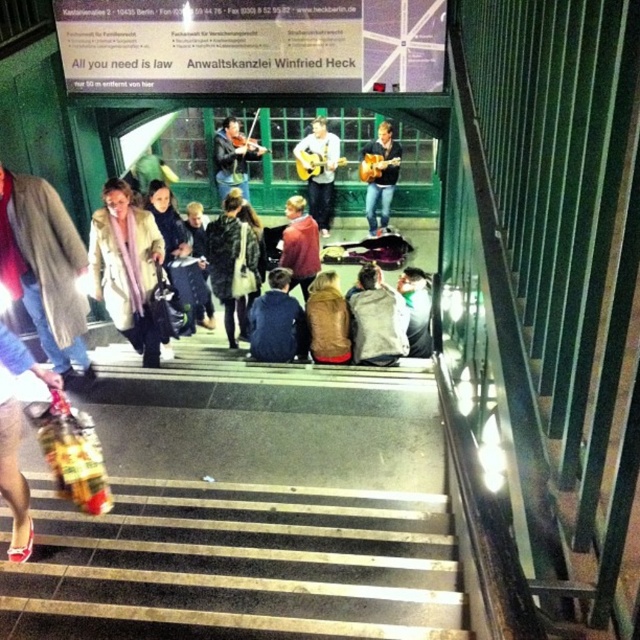
Is leather jacket at center smaller than wooden acoustic guitar at center?

Correct, leather jacket at center occupies less space than wooden acoustic guitar at center.

Who is more distant from viewer, [230,301] or [326,140]?

The point [326,140] is more distant.

Which is in front, point (218, 289) or point (314, 209)?

Point (218, 289)

Locate an element on the screen. leather jacket at center is located at coordinates (232, 264).

You are a GUI agent. You are given a task and a screenshot of the screen. Output one action in this format:
    pyautogui.click(x=<x>, y=<y>)
    Task: Click on the smooth concrete stairs at center
    This screenshot has width=640, height=640.
    Given the screenshot: What is the action you would take?
    pyautogui.click(x=248, y=508)

Who is lower down, smooth concrete stairs at center or light brown leather jacket at center?

Positioned lower is smooth concrete stairs at center.

In order to click on smooth concrete stairs at center in this screenshot , I will do tap(248, 508).

Describe the element at coordinates (44, 268) in the screenshot. I see `light brown fur coat at left` at that location.

Can you confirm if light brown fur coat at left is positioned to the right of leather jacket at center?

Incorrect, light brown fur coat at left is not on the right side of leather jacket at center.

Measure the distance between point (52, 275) and camera.

They are 3.88 meters apart.

Image resolution: width=640 pixels, height=640 pixels. I want to click on light brown fur coat at left, so click(44, 268).